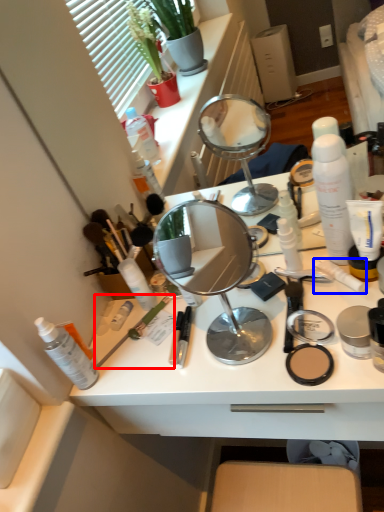
Question: Which object appears farthest to the camera in this image, brush (highlighted by a red box) or toothpaste (highlighted by a blue box)?

Choices:
 (A) brush
 (B) toothpaste

Answer: (A)